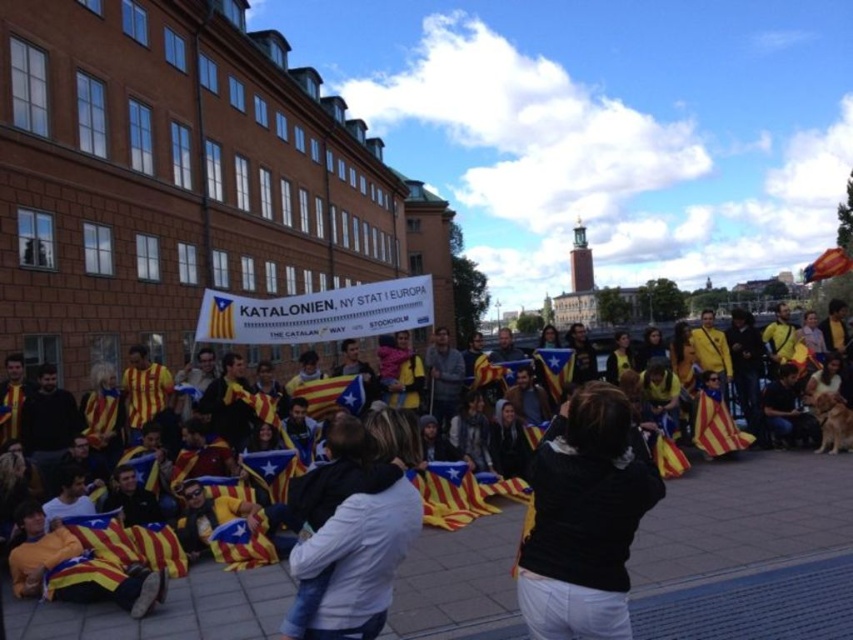
Question: Which point is closer to the camera taking this photo?

Choices:
 (A) (355, 465)
 (B) (561, 496)

Answer: (B)

Question: Which of the following is the closest to the observer?

Choices:
 (A) (107, 611)
 (B) (654, 499)

Answer: (B)

Question: Which point is closer to the camera taking this photo?

Choices:
 (A) (561, 488)
 (B) (515, 618)

Answer: (A)

Question: From the image, what is the correct spatial relationship of yellow fabric flag at center in relation to black fabric at center?

Choices:
 (A) left
 (B) right

Answer: (A)

Question: Can you confirm if black fabric at center is bigger than white cotton shirt at center?

Choices:
 (A) no
 (B) yes

Answer: (B)

Question: Is yellow fabric flag at center further to camera compared to black fabric at center?

Choices:
 (A) no
 (B) yes

Answer: (B)